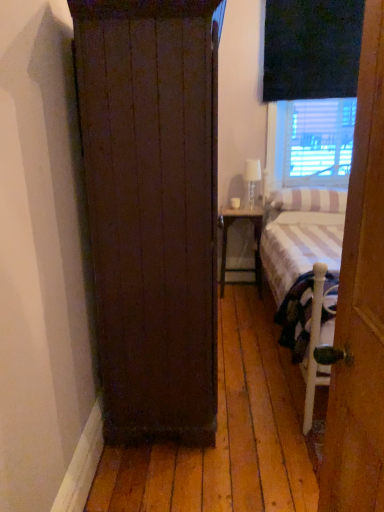
Question: Do you think matte white wood nightstand at center is within white striped pillow at right, or outside of it?

Choices:
 (A) inside
 (B) outside

Answer: (B)

Question: From a real-world perspective, is matte white wood nightstand at center positioned above or below white striped pillow at right?

Choices:
 (A) above
 (B) below

Answer: (B)

Question: Considering the real-world distances, which object is farthest from the white striped fabric bed at right?

Choices:
 (A) wooden door at right
 (B) clear glass lamp at upper right
 (C) dark wood cupboard at left
 (D) white striped pillow at right
 (E) matte white wood nightstand at center

Answer: (A)

Question: Which object is the farthest from the clear glass lamp at upper right?

Choices:
 (A) white striped fabric bed at right
 (B) matte white wood nightstand at center
 (C) dark wood cupboard at left
 (D) wooden door at right
 (E) white striped pillow at right

Answer: (D)